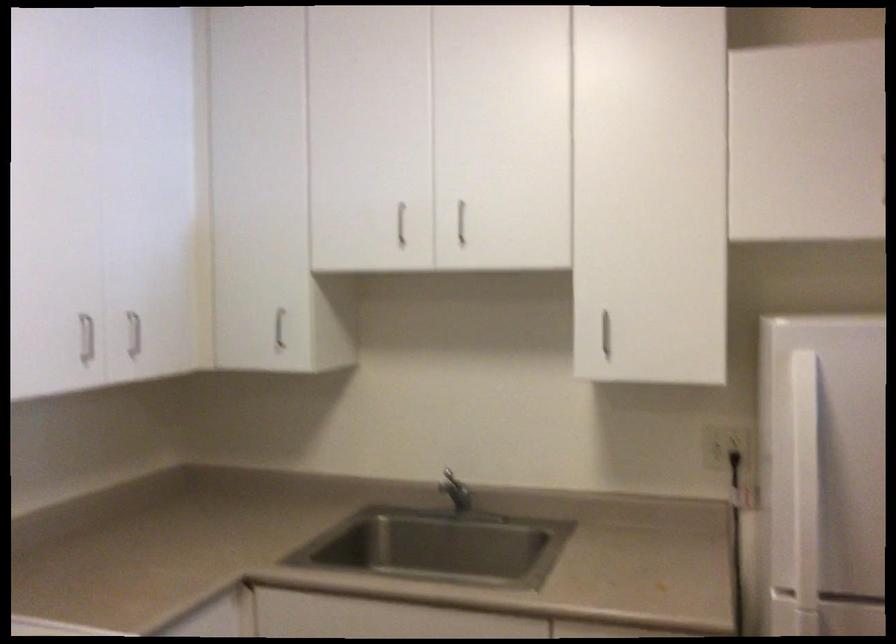
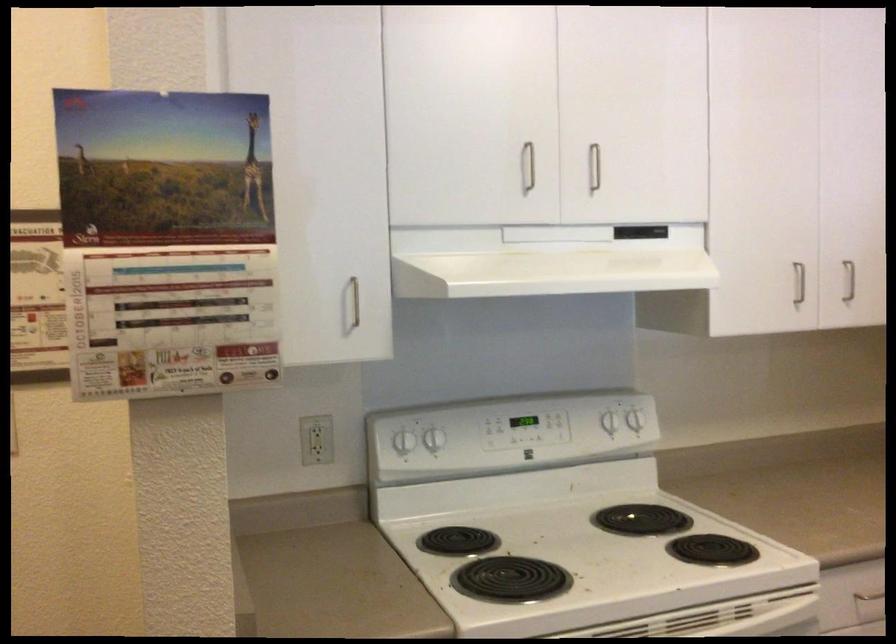
Find the pixel in the second image that matches point (81, 339) in the first image.

(798, 283)